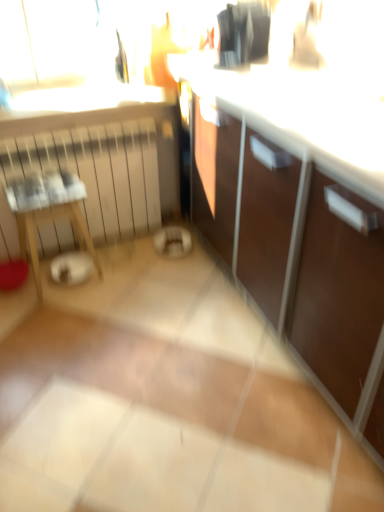
Question: Is the depth of wooden table at left greater than that of black glossy coffee maker at upper center?

Choices:
 (A) no
 (B) yes

Answer: (B)

Question: Could you tell me if wooden table at left is facing black glossy coffee maker at upper center?

Choices:
 (A) no
 (B) yes

Answer: (A)

Question: Is wooden table at left next to black glossy coffee maker at upper center?

Choices:
 (A) yes
 (B) no

Answer: (B)

Question: Is wooden table at left to the left of black glossy coffee maker at upper center from the viewer's perspective?

Choices:
 (A) yes
 (B) no

Answer: (A)

Question: Considering the relative sizes of wooden table at left and black glossy coffee maker at upper center in the image provided, is wooden table at left taller than black glossy coffee maker at upper center?

Choices:
 (A) yes
 (B) no

Answer: (A)

Question: From the image's perspective, relative to white matte radiator at left, is wooden table at left above or below?

Choices:
 (A) above
 (B) below

Answer: (B)

Question: In terms of width, does wooden table at left look wider or thinner when compared to white matte radiator at left?

Choices:
 (A) wide
 (B) thin

Answer: (A)

Question: From a real-world perspective, is wooden table at left positioned above or below white matte radiator at left?

Choices:
 (A) above
 (B) below

Answer: (B)

Question: Based on their positions, is wooden table at left located to the left or right of white matte radiator at left?

Choices:
 (A) left
 (B) right

Answer: (A)

Question: In terms of size, does white matte radiator at left appear bigger or smaller than wooden table at left?

Choices:
 (A) small
 (B) big

Answer: (B)

Question: Is point (66, 129) closer or farther from the camera than point (69, 201)?

Choices:
 (A) farther
 (B) closer

Answer: (A)

Question: Considering the positions of white matte radiator at left and wooden table at left in the image, is white matte radiator at left wider or thinner than wooden table at left?

Choices:
 (A) thin
 (B) wide

Answer: (A)

Question: From a real-world perspective, is white matte radiator at left positioned above or below wooden table at left?

Choices:
 (A) above
 (B) below

Answer: (A)

Question: From a real-world perspective, relative to black glossy coffee maker at upper center, is wooden table at left vertically above or below?

Choices:
 (A) below
 (B) above

Answer: (A)

Question: From the image's perspective, is wooden table at left located above or below black glossy coffee maker at upper center?

Choices:
 (A) above
 (B) below

Answer: (B)